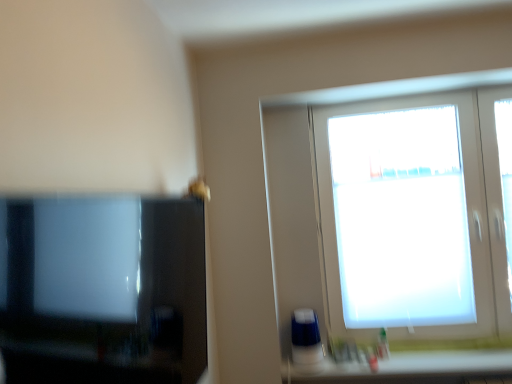
Where is `free area in between white matte window at upper right and translucent plastic bottle at lower right`? free area in between white matte window at upper right and translucent plastic bottle at lower right is located at coordinates (434, 357).